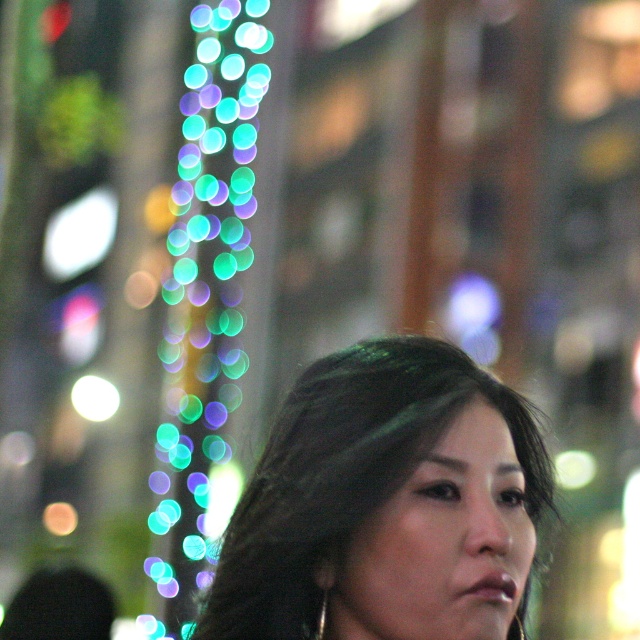
You are a photographer adjusting your camera settings to focus on the subject in the image. The camera has a focus point at point (371, 502). What part of the subject will this focus point target?

The focus point at point (371, 502) will target the smooth dark hair at center.

You are a photographer adjusting the focus on your camera. You want to ensure that both the smooth dark hair at center and the multicolored glass beads at left are in focus. Given the current depth of field, which object is closer to the camera?

The multicolored glass beads at left are closer to the camera than the smooth dark hair at center because the smooth dark hair at center is shorter than multicolored glass beads at left.

You are a photographer adjusting the focus of your camera. You want to ensure that both the smooth dark hair at center and the multicolored glass beads at left are in focus. Given their sizes, which object might require more careful adjustment to achieve sharpness?

The smooth dark hair at center is thinner than the multicolored glass beads at left, so it might require more careful adjustment to achieve sharpness due to its smaller size.